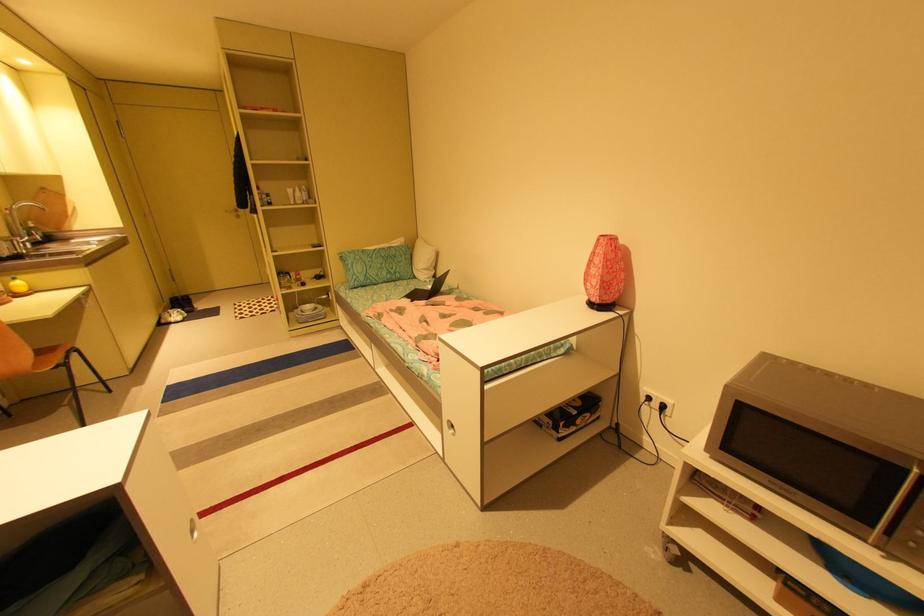
The location [428,289] corresponds to which object?

It corresponds to the black laptop in the image.